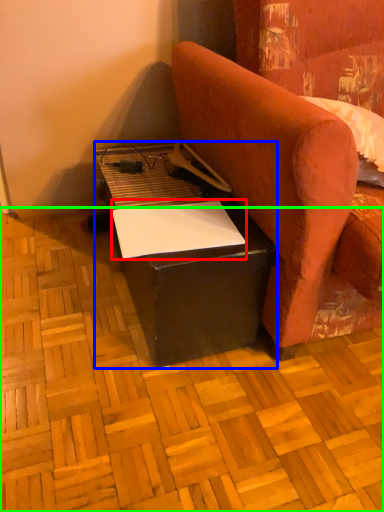
Question: Which is farther away from notepad (highlighted by a red box)? table (highlighted by a blue box) or plywood (highlighted by a green box)?

Choices:
 (A) table
 (B) plywood

Answer: (B)